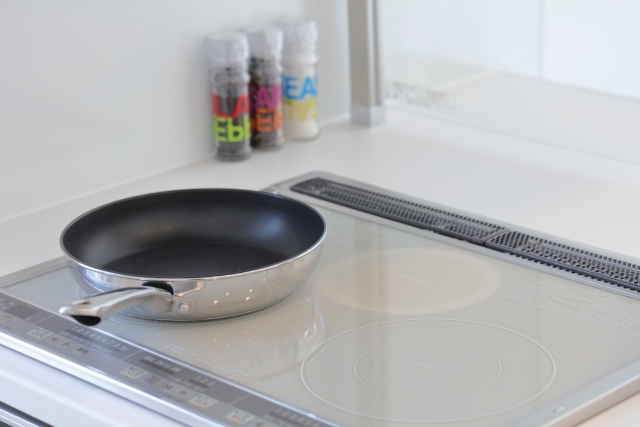
What are the coordinates of `air vents` in the screenshot? It's located at [429, 216], [562, 257].